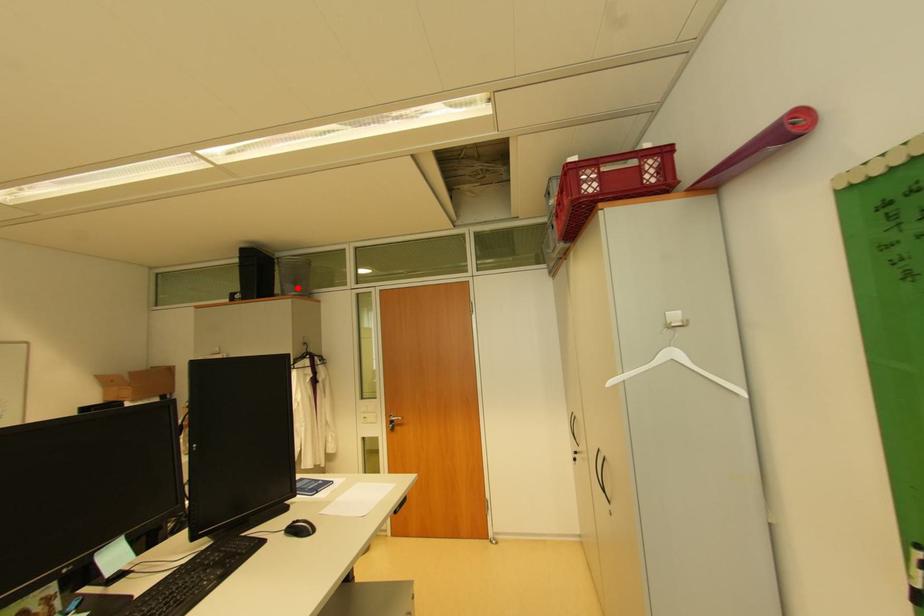
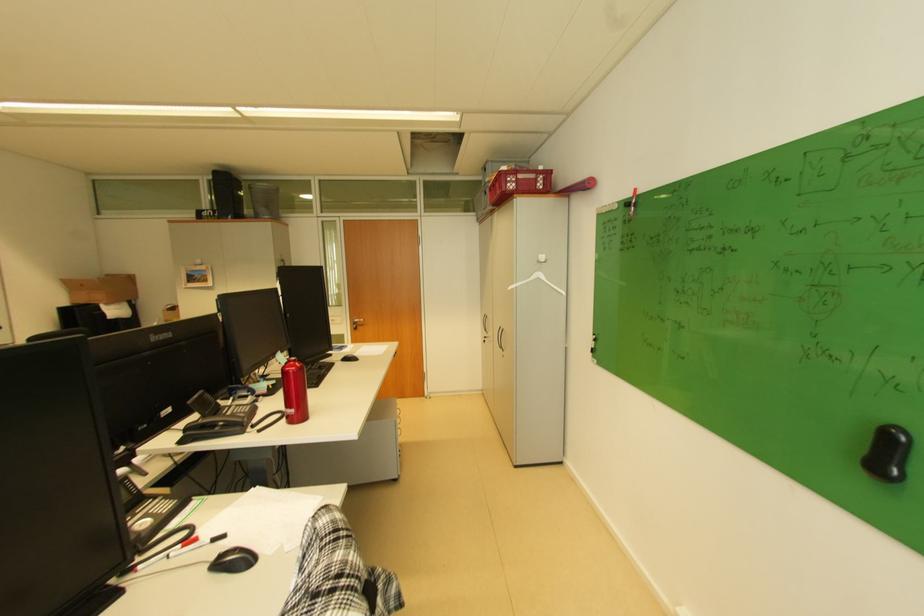
In the second image, find the point that corresponds to the highlighted location in the first image.

(272, 211)